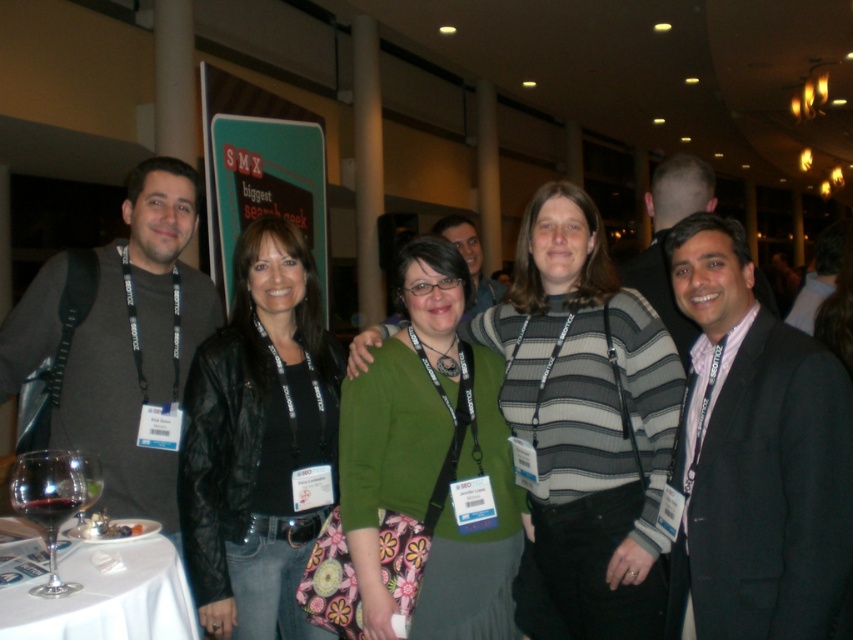
Question: Considering the real-world distances, which object is farthest from the transparent glass at lower left?

Choices:
 (A) transparent glass wine at table left
 (B) striped knit sweater at center
 (C) black leather jacket at left

Answer: (B)

Question: Which object appears closest to the camera in this image?

Choices:
 (A) black leather jacket at left
 (B) green fabric sweater at center
 (C) transparent glass wine at table left
 (D) striped knit sweater at center

Answer: (C)

Question: Estimate the real-world distances between objects in this image. Which object is farther from the black leather jacket at left?

Choices:
 (A) transparent glass wine at table left
 (B) transparent glass at lower left

Answer: (A)

Question: Does striped knit sweater at center have a lesser width compared to black leather jacket at left?

Choices:
 (A) no
 (B) yes

Answer: (A)

Question: Does black leather jacket at left appear over white cloth table at lower left?

Choices:
 (A) yes
 (B) no

Answer: (A)

Question: Is the position of black leather jacket at left less distant than that of transparent glass wine at table left?

Choices:
 (A) no
 (B) yes

Answer: (A)